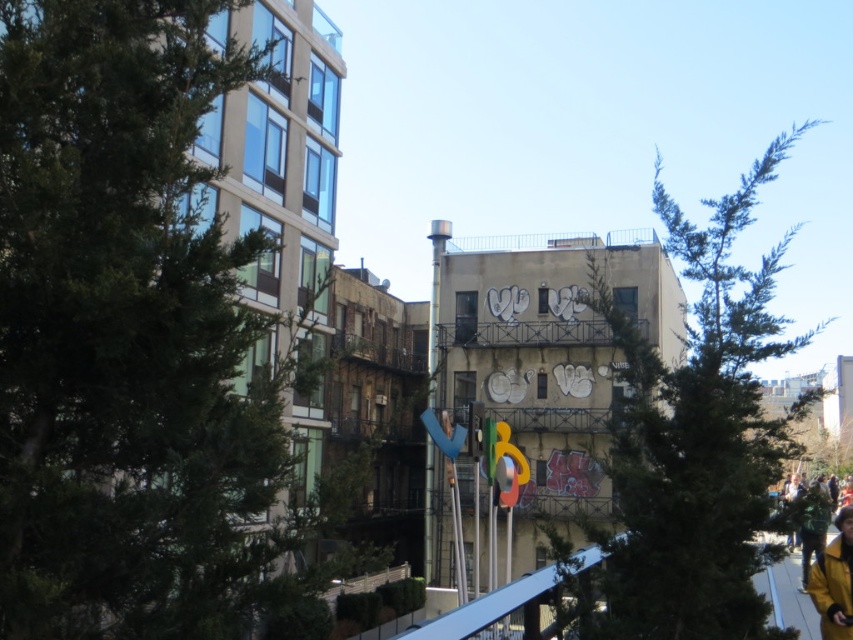
Based on the photo, does green matte tree at left have a larger size compared to yellow matte jacket at lower right?

Yes, green matte tree at left is bigger than yellow matte jacket at lower right.

Who is more distant from viewer, (288, 538) or (842, 552)?

Point (842, 552)

Between point (279, 403) and point (843, 637), which one is positioned in front?

Point (279, 403) is in front.

Find the location of a particular element. The width and height of the screenshot is (853, 640). green matte tree at left is located at coordinates (132, 339).

Is green needle-like tree at center bigger than yellow matte jacket at lower right?

Yes, green needle-like tree at center is bigger than yellow matte jacket at lower right.

Looking at this image, does green needle-like tree at center appear over yellow matte jacket at lower right?

Correct, green needle-like tree at center is located above yellow matte jacket at lower right.

Who is more distant from viewer, (x=706, y=348) or (x=845, y=540)?

Point (x=845, y=540)

The image size is (853, 640). In order to click on green needle-like tree at center in this screenshot , I will do `click(697, 440)`.

What do you see at coordinates (132, 339) in the screenshot? This screenshot has width=853, height=640. I see `green matte tree at left` at bounding box center [132, 339].

Is green matte tree at left below green needle-like tree at center?

Yes, green matte tree at left is below green needle-like tree at center.

Is point (137, 216) positioned before point (720, 356)?

Yes.

Locate an element on the screen. green matte tree at left is located at coordinates (132, 339).